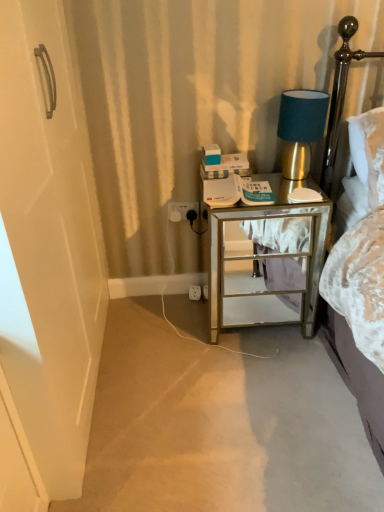
Where is `vacant area that is in front of white plastic electric outlet at lower center, arranged as the 2th electric outlet when viewed from the front`? vacant area that is in front of white plastic electric outlet at lower center, arranged as the 2th electric outlet when viewed from the front is located at coordinates (198, 320).